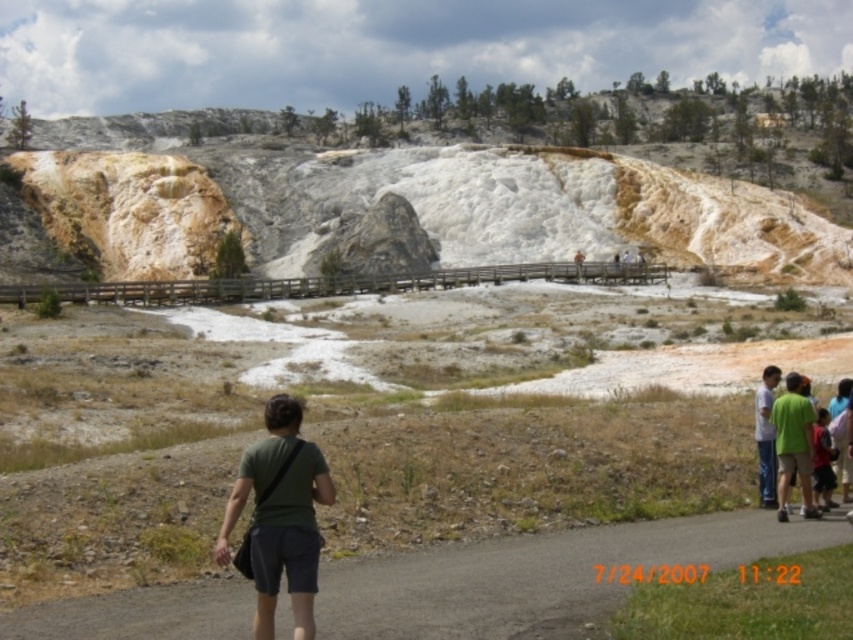
Question: Does gray asphalt path at lower center have a lesser width compared to green fabric shirt at center?

Choices:
 (A) no
 (B) yes

Answer: (A)

Question: Which point is farther to the camera?

Choices:
 (A) green fabric shirt at lower right
 (B) dark green shirt at lower right

Answer: (B)

Question: Does dark green shirt at lower right appear on the right side of green fabric shirt at center?

Choices:
 (A) yes
 (B) no

Answer: (B)

Question: Among these points, which one is nearest to the camera?

Choices:
 (A) (581, 259)
 (B) (535, 538)

Answer: (B)

Question: Does green fabric shirt at right appear on the right side of dark green shirt at lower right?

Choices:
 (A) no
 (B) yes

Answer: (B)

Question: Which object is farther from the camera taking this photo?

Choices:
 (A) gray asphalt path at lower center
 (B) dark green shirt at lower right
 (C) green fabric shirt at lower right
 (D) green fabric shirt at center

Answer: (D)